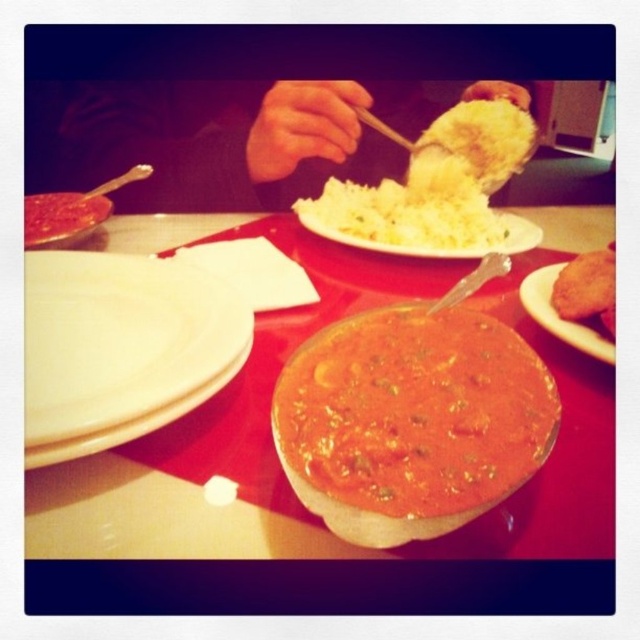
Between yellow fluffy rice at upper center and golden crispy fried chicken at right, which one has less height?

Standing shorter between the two is golden crispy fried chicken at right.

Is the position of yellow fluffy rice at upper center more distant than that of golden crispy fried chicken at right?

That is True.

Where is `yellow fluffy rice at upper center`? This screenshot has height=640, width=640. yellow fluffy rice at upper center is located at coordinates (477, 141).

Is matte ceramic bowl at center shorter than white fluffy rice at upper center?

No, matte ceramic bowl at center is not shorter than white fluffy rice at upper center.

Does matte ceramic bowl at center appear on the right side of white fluffy rice at upper center?

Incorrect, matte ceramic bowl at center is not on the right side of white fluffy rice at upper center.

Describe the element at coordinates (241, 493) in the screenshot. I see `matte ceramic bowl at center` at that location.

Find the location of a particular element. matte ceramic bowl at center is located at coordinates (241, 493).

Is matte ceramic bowl at center taller than matte white plate at left?

Answer: Yes, matte ceramic bowl at center is taller than matte white plate at left.

Locate an element on the screen. matte ceramic bowl at center is located at coordinates (241, 493).

Find the location of a particular element. This screenshot has width=640, height=640. matte ceramic bowl at center is located at coordinates (241, 493).